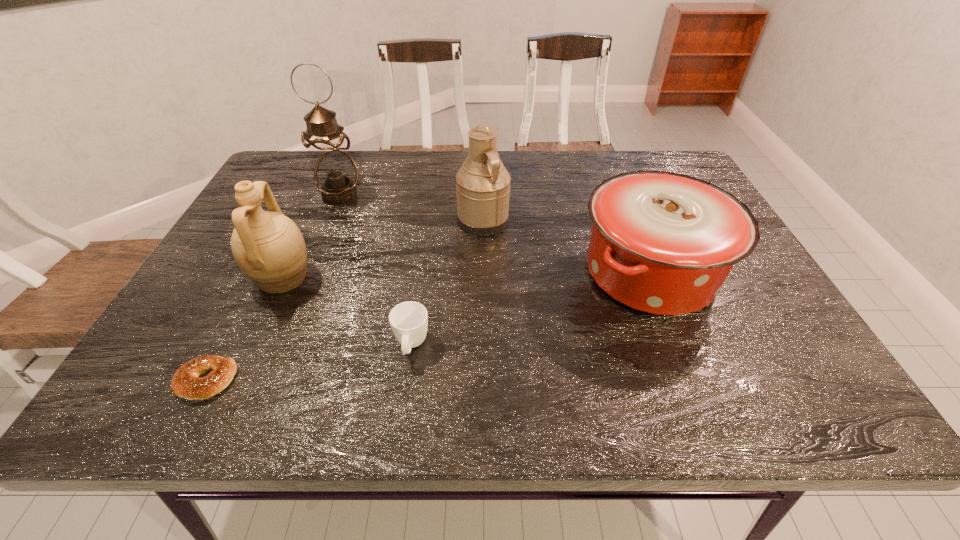
The height and width of the screenshot is (540, 960). In order to click on vacant point located between the left pitcher and the fourth object from left to right in this screenshot , I will do `click(347, 312)`.

This screenshot has width=960, height=540. I want to click on vacant space that is in between the bagel and the third object from right to left, so coord(309,363).

Find the location of `empty location between the farther pitcher and the tallest object`. empty location between the farther pitcher and the tallest object is located at coordinates (411, 208).

Identify the location of free space between the fifth tallest object and the third shortest object. This screenshot has height=540, width=960. (531, 309).

Image resolution: width=960 pixels, height=540 pixels. I want to click on object that is the fourth closest one to the bagel, so click(483, 184).

Identify which object is the fifth nearest to the fourth tallest object. Please provide its 2D coordinates. Your answer should be formatted as a tuple, i.e. [(x, y)], where the tuple contains the x and y coordinates of a point satisfying the conditions above.

[(186, 383)]